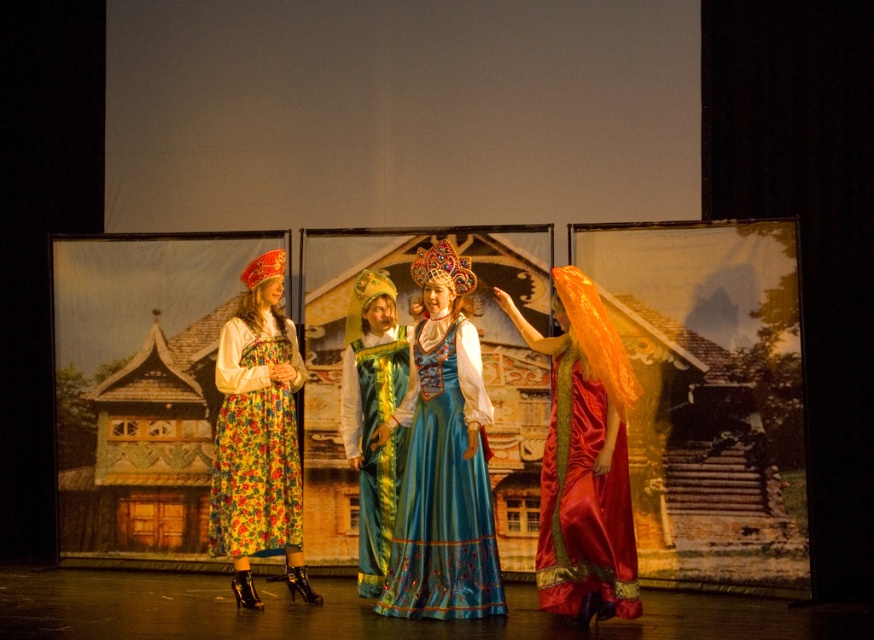
You are a costume designer reviewing the stage setup for a play. You notice the shiny red silk dress at right and the floral fabric dress at left. Based on their sizes, which dress would require more fabric to create?

The floral fabric dress at left requires more fabric because it is larger than the shiny red silk dress at right.

You are standing in the theater and want to place a small prop at the point marked by coordinates point (584, 500). According to the image description, where exactly will this prop be placed?

The point (584, 500) is on the shiny red silk dress at right, so placing the prop there would position it on the shiny red silk dress at right.